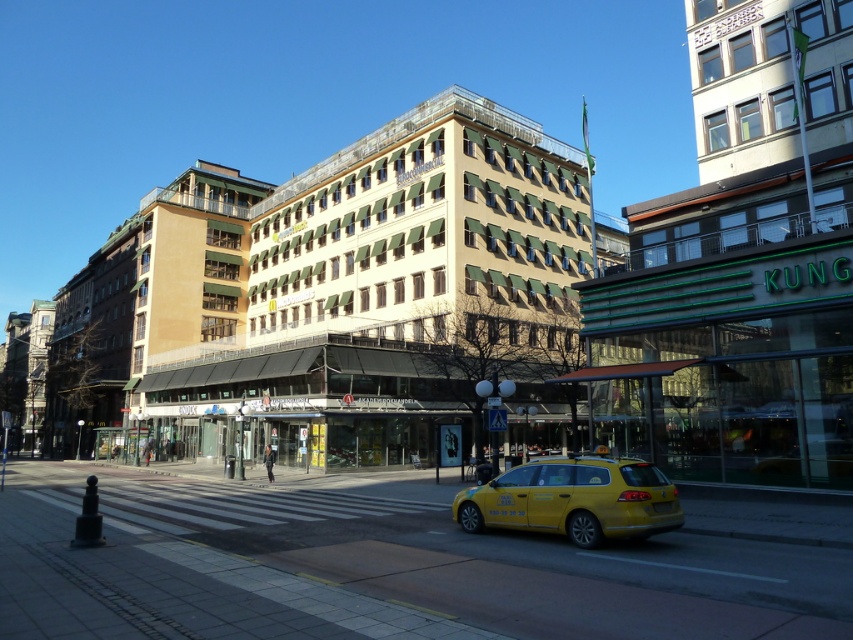
Question: Can you confirm if white glass building at upper right is positioned to the right of yellow matte taxi at lower center?

Choices:
 (A) yes
 (B) no

Answer: (A)

Question: Which of the following is the farthest from the observer?

Choices:
 (A) (758, 216)
 (B) (517, 516)

Answer: (A)

Question: Can you confirm if white glass building at upper right is positioned to the left of yellow matte taxi at lower center?

Choices:
 (A) no
 (B) yes

Answer: (A)

Question: Does white glass building at upper right appear on the left side of yellow matte taxi at lower center?

Choices:
 (A) yes
 (B) no

Answer: (B)